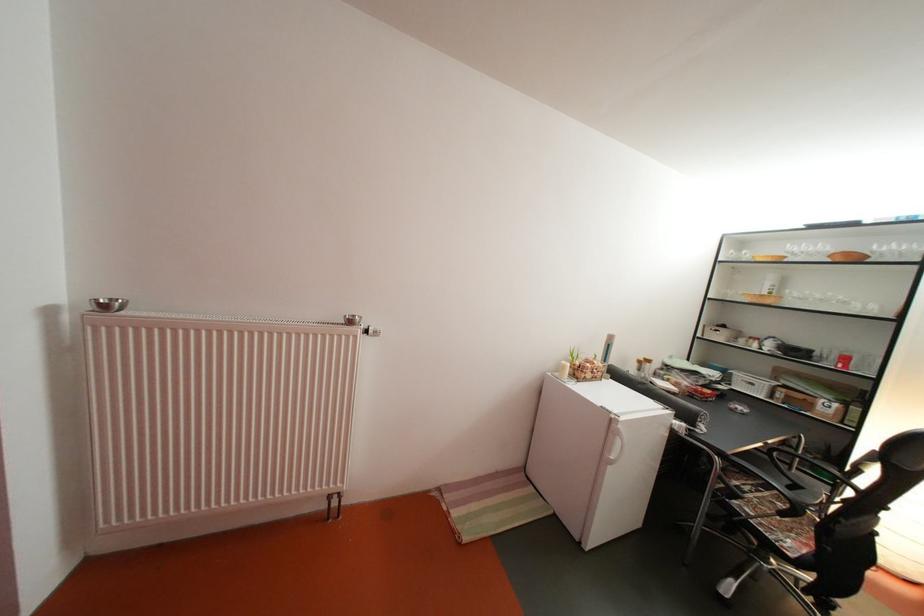
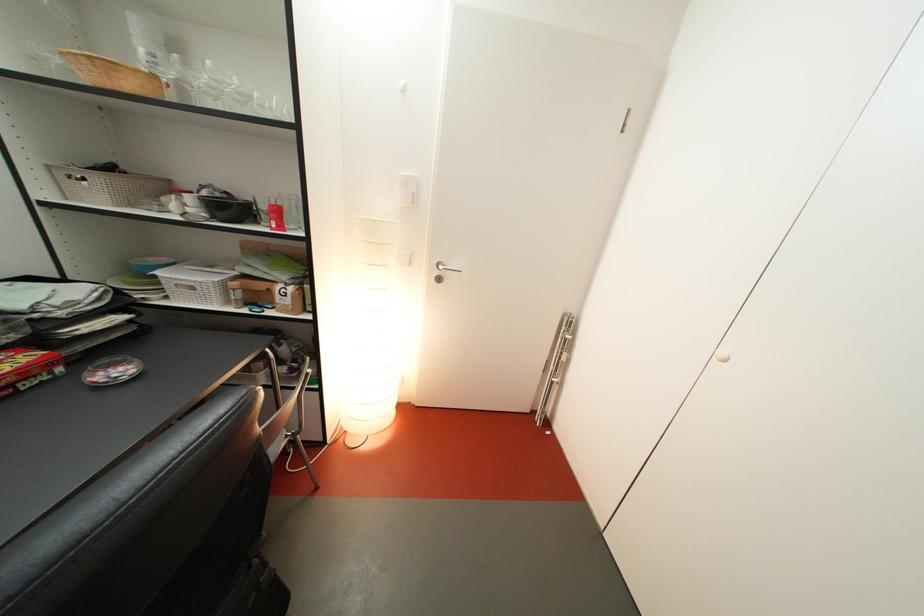
Locate, in the second image, the point that corresponds to point (791, 402) in the first image.

(249, 301)